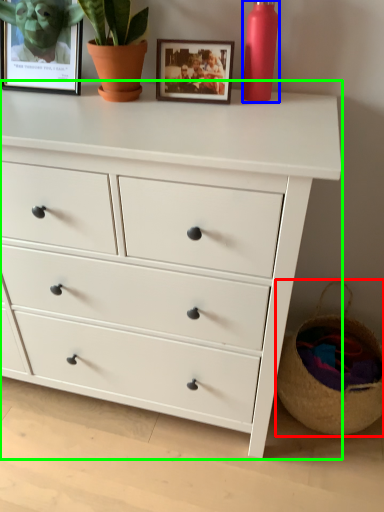
Question: Which object is positioned closest to basket (highlighted by a red box)? Select from bottle (highlighted by a blue box) and chest of drawers (highlighted by a green box).

Choices:
 (A) bottle
 (B) chest of drawers

Answer: (B)